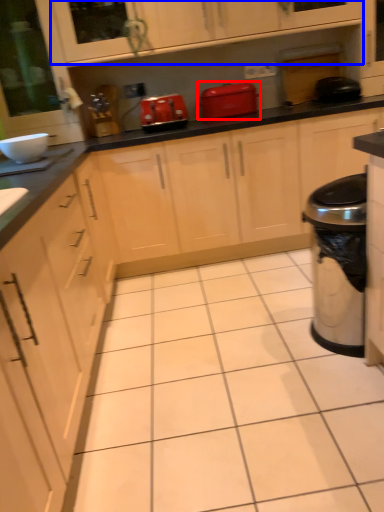
Question: Which object appears farthest to the camera in this image, home appliance (highlighted by a red box) or cabinetry (highlighted by a blue box)?

Choices:
 (A) home appliance
 (B) cabinetry

Answer: (A)